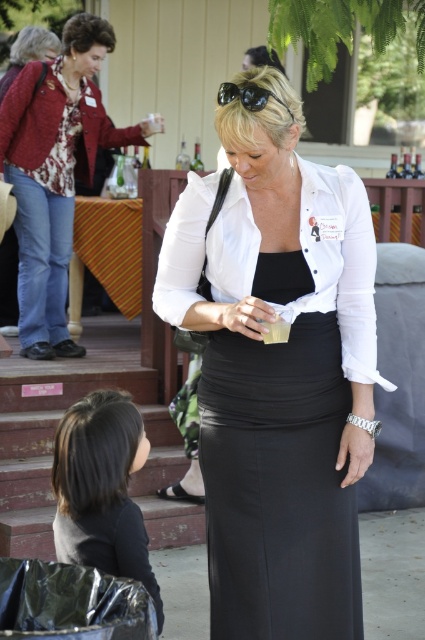
Question: Can you confirm if matte red jacket at upper left is wider than black fabric hair at lower left?

Choices:
 (A) no
 (B) yes

Answer: (B)

Question: Is white matte shirt at center to the right of black matte sunglasses at center from the viewer's perspective?

Choices:
 (A) no
 (B) yes

Answer: (B)

Question: Which point is closer to the camera?

Choices:
 (A) (x=99, y=456)
 (B) (x=232, y=99)
 (C) (x=68, y=180)

Answer: (B)

Question: Can you confirm if matte red jacket at upper left is thinner than black fabric hair at lower left?

Choices:
 (A) yes
 (B) no

Answer: (B)

Question: Considering the real-world distances, which object is closest to the black fabric hair at lower left?

Choices:
 (A) black matte sunglasses at center
 (B) matte red jacket at upper left
 (C) matte white blouse at center
 (D) white matte shirt at center

Answer: (C)

Question: Which is nearer to the black fabric hair at lower left?

Choices:
 (A) white matte shirt at center
 (B) matte white blouse at center

Answer: (B)